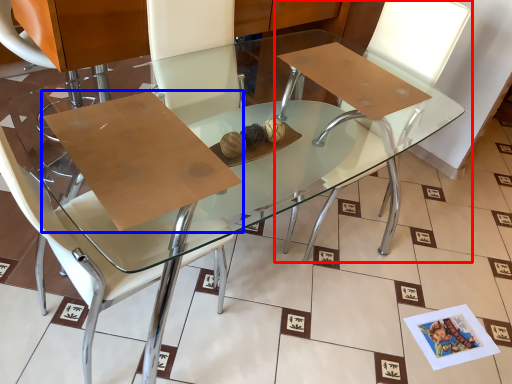
Question: Which object is further to the camera taking this photo, chair (highlighted by a red box) or cardboard (highlighted by a blue box)?

Choices:
 (A) chair
 (B) cardboard

Answer: (A)